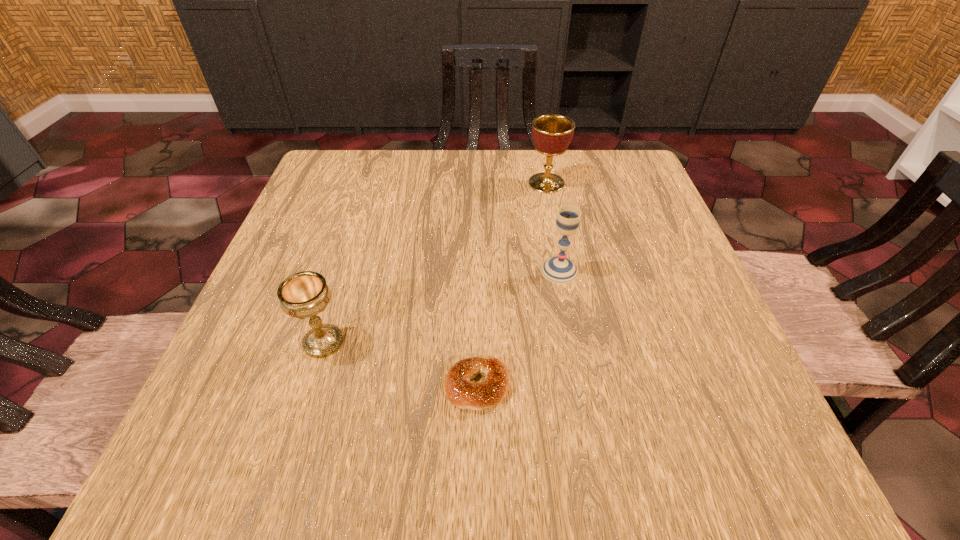
In order to click on object present at the far edge in this screenshot , I will do `click(552, 133)`.

At what (x,y) coordinates should I click in order to perform the action: click on object situated at the left edge. Please return your answer as a coordinate pair (x, y). Looking at the image, I should click on pyautogui.click(x=305, y=294).

This screenshot has height=540, width=960. In the image, there is a desktop. In order to click on free space at the far edge in this screenshot , I will do `click(470, 153)`.

The width and height of the screenshot is (960, 540). Identify the location of vacant space at the near edge. (483, 429).

Image resolution: width=960 pixels, height=540 pixels. In the image, there is a desktop. Identify the location of free space at the left edge. (274, 395).

Find the location of a particular element. The height and width of the screenshot is (540, 960). vacant point at the right edge is located at coordinates (660, 264).

In order to click on vacant space at the far left corner of the desktop in this screenshot , I will do `click(366, 180)`.

Find the location of a particular element. The width and height of the screenshot is (960, 540). vacant space at the near left corner of the desktop is located at coordinates (209, 436).

In order to click on vacant space at the far right corner of the desktop in this screenshot , I will do `click(629, 198)`.

You are a GUI agent. You are given a task and a screenshot of the screen. Output one action in this format:
    pyautogui.click(x=<x>, y=<y>)
    Task: Click on the free space at the near right corner of the desktop
    The width and height of the screenshot is (960, 540).
    Given the screenshot: What is the action you would take?
    pyautogui.click(x=670, y=459)